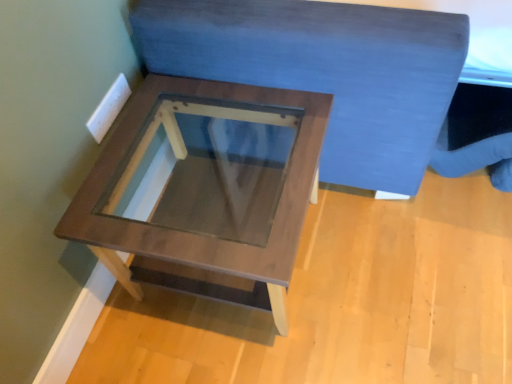
Question: From a real-world perspective, is wooden table at center above or below velvet blue bedding at upper center?

Choices:
 (A) above
 (B) below

Answer: (B)

Question: Considering the positions of wooden table at center and velvet blue bedding at upper center in the image, is wooden table at center bigger or smaller than velvet blue bedding at upper center?

Choices:
 (A) small
 (B) big

Answer: (A)

Question: Considering the positions of point (211, 168) and point (387, 21), is point (211, 168) closer or farther from the camera than point (387, 21)?

Choices:
 (A) closer
 (B) farther

Answer: (B)

Question: Is velvet blue bedding at upper center situated inside wooden table at center or outside?

Choices:
 (A) inside
 (B) outside

Answer: (B)

Question: From the image's perspective, is velvet blue bedding at upper center positioned above or below wooden table at center?

Choices:
 (A) below
 (B) above

Answer: (B)

Question: Considering the positions of velvet blue bedding at upper center and wooden table at center in the image, is velvet blue bedding at upper center taller or shorter than wooden table at center?

Choices:
 (A) short
 (B) tall

Answer: (B)

Question: Is velvet blue bedding at upper center wider or thinner than wooden table at center?

Choices:
 (A) thin
 (B) wide

Answer: (B)